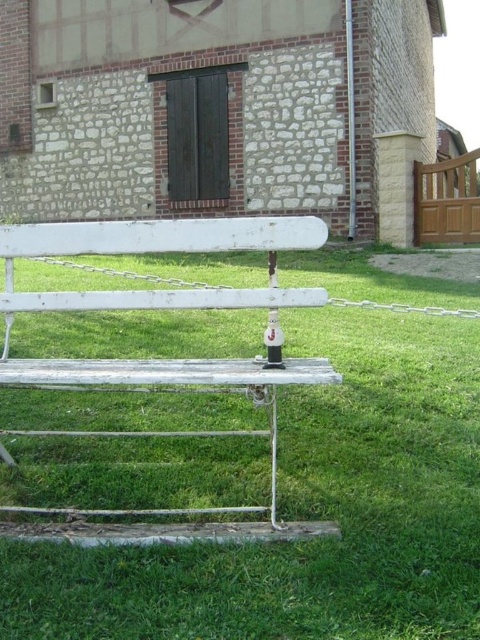
Question: Which point appears closest to the camera in this image?

Choices:
 (A) (296, 604)
 (B) (300, 305)

Answer: (A)

Question: Can you confirm if green grass at center is positioned to the left of white painted wood park bench at center?

Choices:
 (A) no
 (B) yes

Answer: (A)

Question: Can you confirm if green grass at center is wider than white painted wood park bench at center?

Choices:
 (A) no
 (B) yes

Answer: (B)

Question: Which point is closer to the camera?

Choices:
 (A) (200, 433)
 (B) (233, 426)

Answer: (A)

Question: Observing the image, what is the correct spatial positioning of green grass at center in reference to white painted wood park bench at center?

Choices:
 (A) above
 (B) below

Answer: (B)